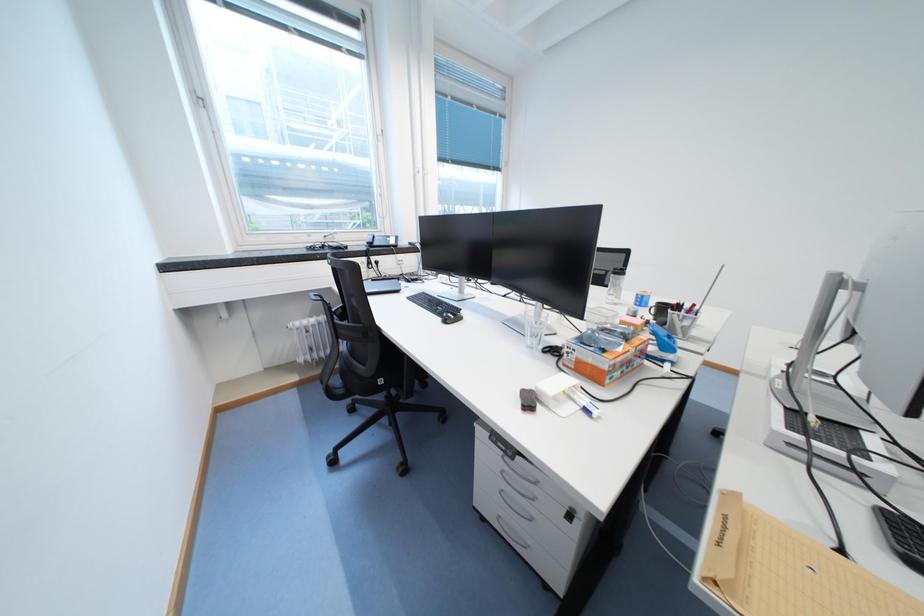
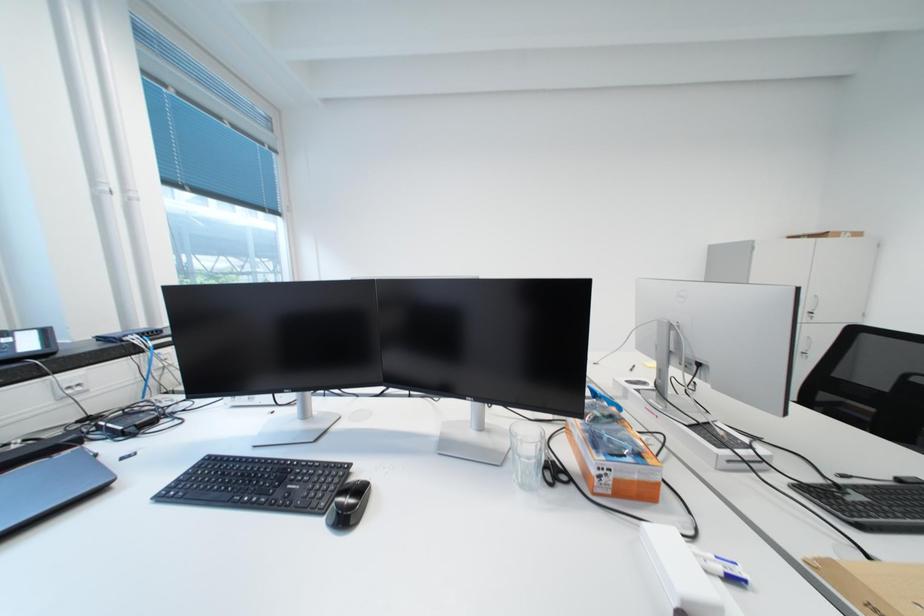
Question: The camera is either moving clockwise (left) or counter-clockwise (right) around the object. The first image is from the beginning of the video and the second image is from the end. Is the camera moving left or right when shooting the video?

Choices:
 (A) Left
 (B) Right

Answer: (A)